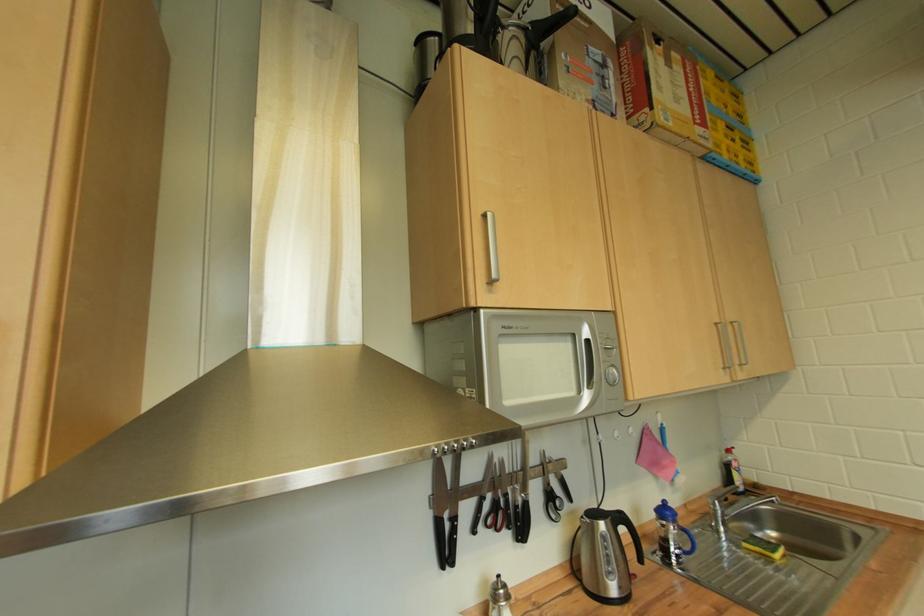
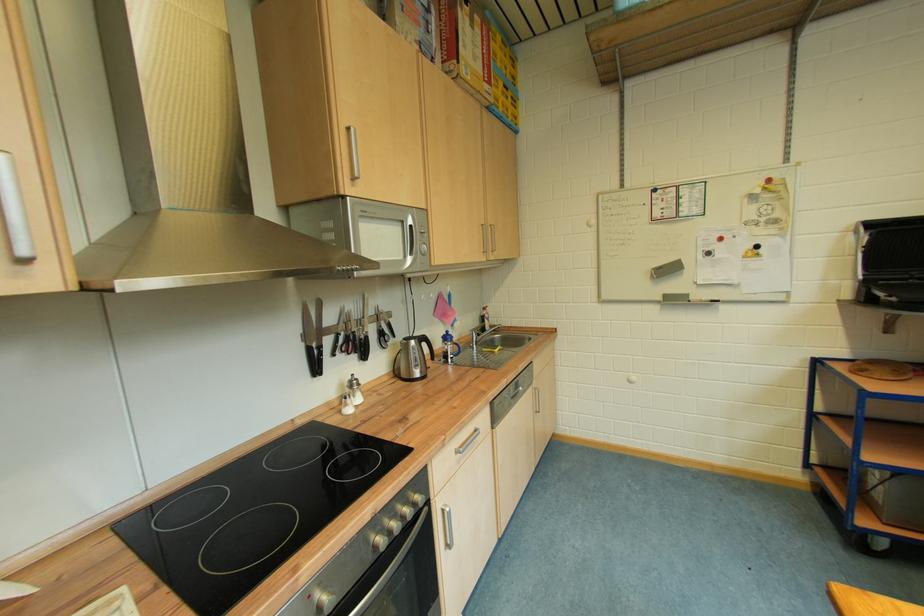
Locate, in the second image, the point that corresponds to [629,533] in the first image.

(432, 347)